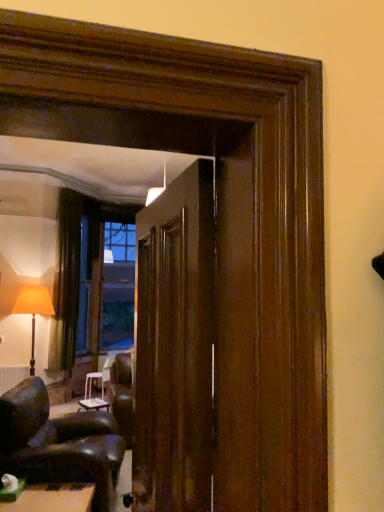
This screenshot has width=384, height=512. In order to click on vacant region above green felt table at lower left, positioned as the first table in front-to-back order (from a real-world perspective) in this screenshot , I will do (41, 496).